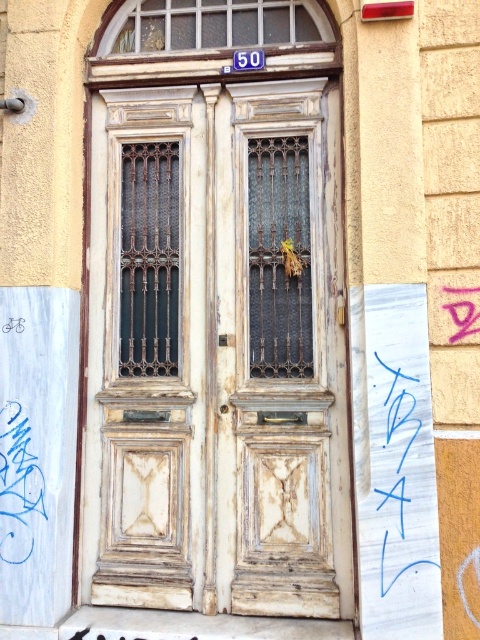
Question: Is white weathered wood door at center thinner than blue marker writing at center?

Choices:
 (A) no
 (B) yes

Answer: (A)

Question: Which point is closer to the camera?

Choices:
 (A) blue marker writing at center
 (B) white weathered wood door at center

Answer: (A)

Question: Does white weathered wood door at center lie in front of blue marker writing at center?

Choices:
 (A) yes
 (B) no

Answer: (B)

Question: Can you confirm if white weathered wood door at center is thinner than blue marker writing at center?

Choices:
 (A) yes
 (B) no

Answer: (B)